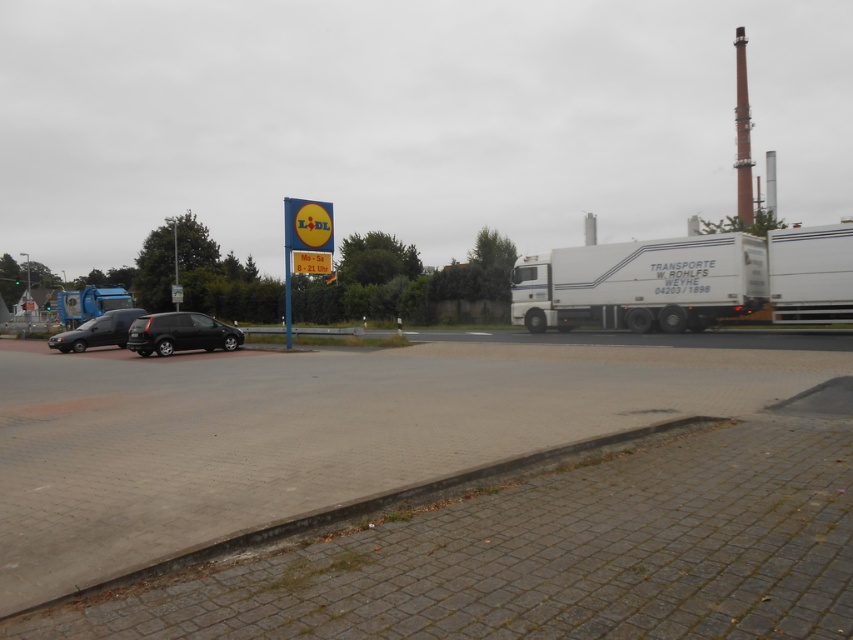
You are standing at the point with coordinates (641, 284) in the image. What object are you standing on?

You are standing on the white matte trailer truck at right.

You are standing at the grassy area near the curb and want to walk to the parked cars on the red pavement. Which point should you aim for first, point (531, 276) or point (218, 346), to reach the cars more quickly?

You should aim for point (218, 346) first because point (531, 276) is behind it, meaning point (218, 346) is closer to your current position at the grassy area near the curb.

You are a delivery person trying to navigate through the commercial area. You see the blue plastic sign at center and the shiny black car at lower left. Which object is taller when viewed from your perspective?

The blue plastic sign at center is taller than the shiny black car at lower left.